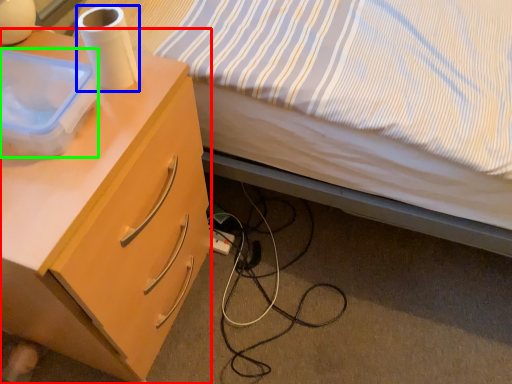
Question: Estimate the real-world distances between objects in this image. Which object is farther from desk (highlighted by a red box), paper towel (highlighted by a blue box) or box (highlighted by a green box)?

Choices:
 (A) paper towel
 (B) box

Answer: (A)